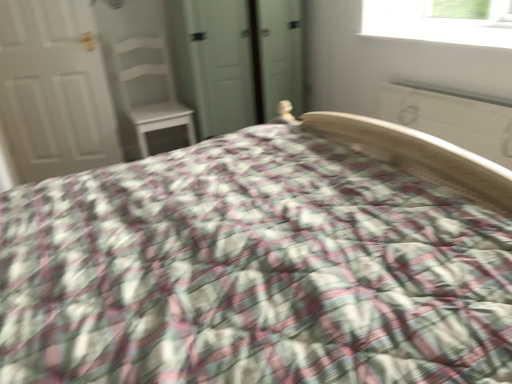
Question: Can you confirm if white wood chair at upper left is positioned to the right of plaid fabric bed at center?

Choices:
 (A) no
 (B) yes

Answer: (A)

Question: Can you confirm if white wood chair at upper left is thinner than plaid fabric bed at center?

Choices:
 (A) yes
 (B) no

Answer: (A)

Question: Considering the relative sizes of white wood chair at upper left and plaid fabric bed at center in the image provided, is white wood chair at upper left wider than plaid fabric bed at center?

Choices:
 (A) no
 (B) yes

Answer: (A)

Question: Is white wood chair at upper left facing towards plaid fabric bed at center?

Choices:
 (A) no
 (B) yes

Answer: (B)

Question: Considering the relative positions of white wood chair at upper left and plaid fabric bed at center in the image provided, is white wood chair at upper left to the left of plaid fabric bed at center from the viewer's perspective?

Choices:
 (A) no
 (B) yes

Answer: (B)

Question: In terms of size, does white smooth window sill at upper right appear bigger or smaller than white wood chair at upper left?

Choices:
 (A) small
 (B) big

Answer: (A)

Question: From a real-world perspective, is white smooth window sill at upper right physically located above or below white wood chair at upper left?

Choices:
 (A) above
 (B) below

Answer: (A)

Question: Choose the correct answer: Is white smooth window sill at upper right inside white wood chair at upper left or outside it?

Choices:
 (A) inside
 (B) outside

Answer: (B)

Question: Visually, is white smooth window sill at upper right positioned to the left or to the right of white wood chair at upper left?

Choices:
 (A) left
 (B) right

Answer: (B)

Question: In terms of width, does plaid fabric bed at center look wider or thinner when compared to white matte door at left?

Choices:
 (A) thin
 (B) wide

Answer: (B)

Question: Looking at the image, does plaid fabric bed at center seem bigger or smaller compared to white matte door at left?

Choices:
 (A) small
 (B) big

Answer: (B)

Question: From a real-world perspective, is plaid fabric bed at center above or below white matte door at left?

Choices:
 (A) above
 (B) below

Answer: (A)

Question: Is plaid fabric bed at center inside or outside of white matte door at left?

Choices:
 (A) outside
 (B) inside

Answer: (A)

Question: From the image's perspective, is white wood chair at upper left located above or below white painted wood radiator at upper right?

Choices:
 (A) below
 (B) above

Answer: (B)

Question: Looking at their shapes, would you say white wood chair at upper left is wider or thinner than white painted wood radiator at upper right?

Choices:
 (A) wide
 (B) thin

Answer: (A)